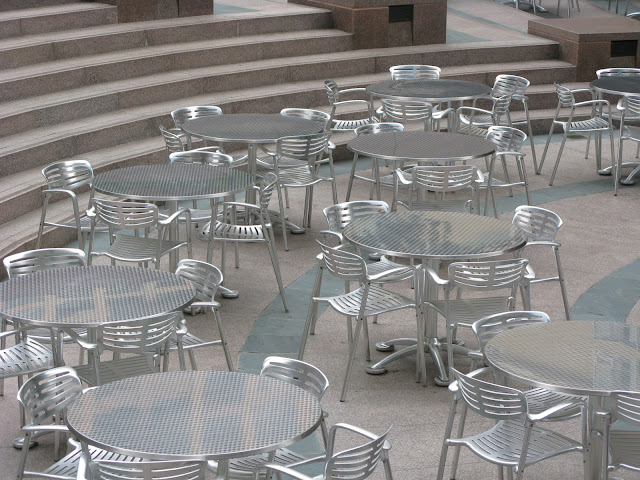
Where is `table 1 chairs`? The width and height of the screenshot is (640, 480). table 1 chairs is located at coordinates (52, 393), (303, 368), (342, 467), (175, 468).